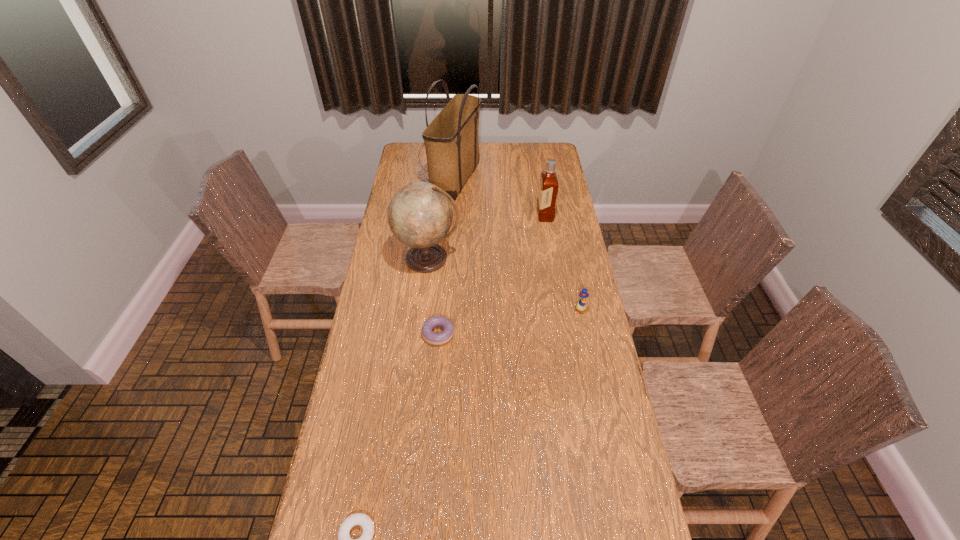
Find the location of a particular element. The image size is (960, 540). vacant space located on the left of the tote bag is located at coordinates (396, 178).

Where is `vacant space situated on the front-facing side of the fourth nearest object`? The image size is (960, 540). vacant space situated on the front-facing side of the fourth nearest object is located at coordinates (422, 312).

Find the location of `vacant space located 0.360m on the front label of the second object from right to left`. vacant space located 0.360m on the front label of the second object from right to left is located at coordinates (459, 215).

Locate an element on the screen. This screenshot has width=960, height=540. vacant region located 0.060m on the front label of the second object from right to left is located at coordinates (524, 215).

Identify the location of free space located 0.380m on the front label of the second object from right to left. (454, 215).

Where is `vacant space located on the face of the fourth tallest object, where the monocle is placed`? This screenshot has width=960, height=540. vacant space located on the face of the fourth tallest object, where the monocle is placed is located at coordinates click(x=594, y=382).

Where is `free space located 0.150m on the front of the taller doughnut`? Image resolution: width=960 pixels, height=540 pixels. free space located 0.150m on the front of the taller doughnut is located at coordinates (434, 386).

The width and height of the screenshot is (960, 540). Find the location of `object at the far edge`. object at the far edge is located at coordinates tap(451, 140).

Identify the location of object located in the left edge section of the desktop. (420, 214).

Image resolution: width=960 pixels, height=540 pixels. Find the location of `liquor located in the right edge section of the desktop`. liquor located in the right edge section of the desktop is located at coordinates (548, 189).